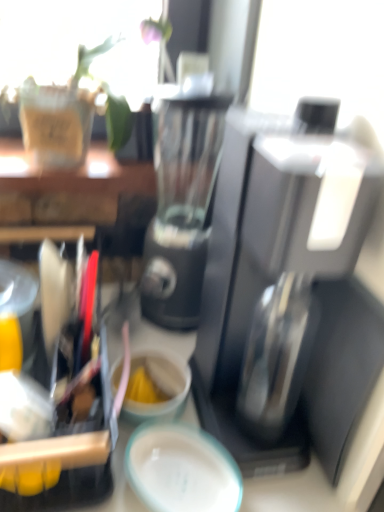
Question: Is matte ceramic coffee cup at center inside the boundaries of sleek black coffee maker at center, or outside?

Choices:
 (A) outside
 (B) inside

Answer: (A)

Question: From a real-world perspective, is matte ceramic coffee cup at center physically located above or below sleek black coffee maker at center?

Choices:
 (A) above
 (B) below

Answer: (B)

Question: Considering the real-world distances, which object is closest to the teal glossy plate at center?

Choices:
 (A) sleek black coffee maker at center
 (B) matte ceramic coffee cup at center

Answer: (B)

Question: Which object is the closest to the matte ceramic coffee cup at center?

Choices:
 (A) teal glossy plate at center
 (B) sleek black coffee maker at center

Answer: (A)